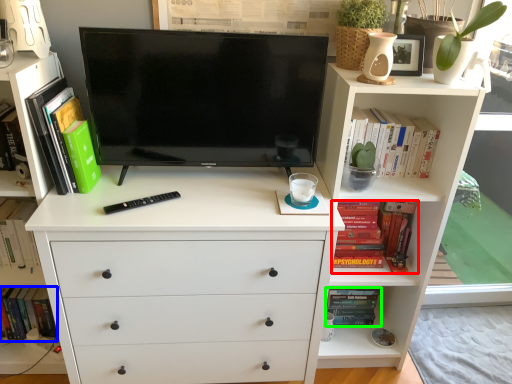
Question: Which object is positioned farthest from book (highlighted by a red box)? Select from book (highlighted by a blue box) and book (highlighted by a green box).

Choices:
 (A) book
 (B) book

Answer: (A)